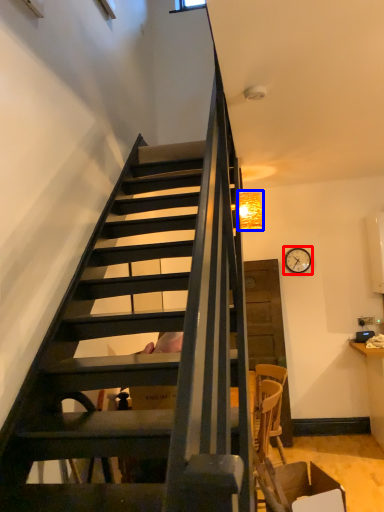
Question: Which of the following is the farthest to the observer, clock (highlighted by a red box) or lamp (highlighted by a blue box)?

Choices:
 (A) clock
 (B) lamp

Answer: (A)